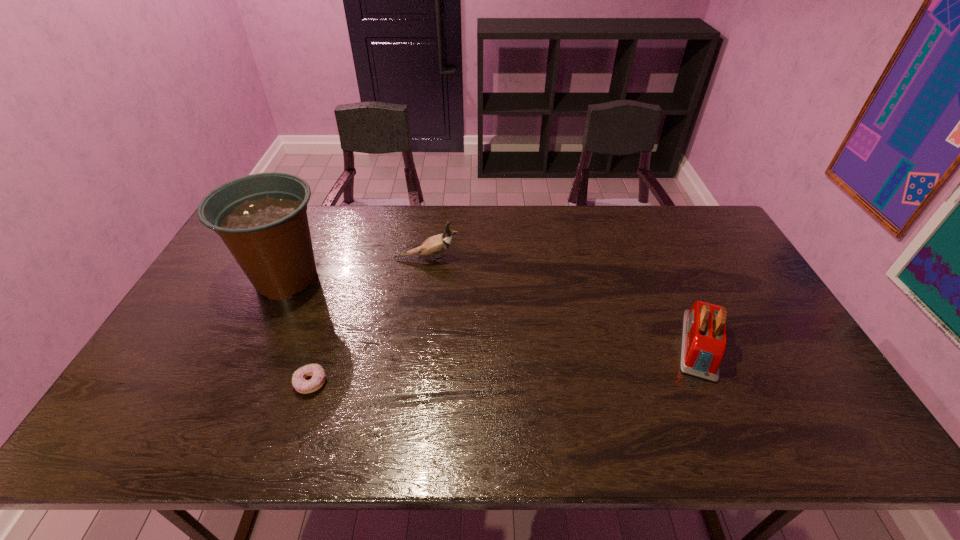
Identify the location of free space between the rightmost object and the tallest object. The image size is (960, 540). (493, 312).

Where is `blank region between the doughnut and the third object from left to right`? blank region between the doughnut and the third object from left to right is located at coordinates (369, 321).

Where is `free space between the tallest object and the shortest object`? The width and height of the screenshot is (960, 540). free space between the tallest object and the shortest object is located at coordinates (299, 331).

Identify the location of empty space that is in between the flowerpot and the toaster. The width and height of the screenshot is (960, 540). (493, 312).

I want to click on empty space between the doughnut and the toaster, so click(x=505, y=364).

The image size is (960, 540). In order to click on the third closest object to the shortest object in this screenshot , I will do coord(703,347).

Identify the location of object that is the second closest to the shortest object. (435, 245).

Identify the location of vacant space that satisfies the following two spatial constraints: 1. on the front side of the tallest object; 2. on the left side of the shortest object. This screenshot has height=540, width=960. (238, 383).

Locate an element on the screen. vacant space that satisfies the following two spatial constraints: 1. at the face of the bird; 2. on the front side of the doughnut is located at coordinates (410, 383).

In order to click on free space that satisfies the following two spatial constraints: 1. at the face of the bird; 2. on the back side of the rightmost object in this screenshot , I will do `click(416, 345)`.